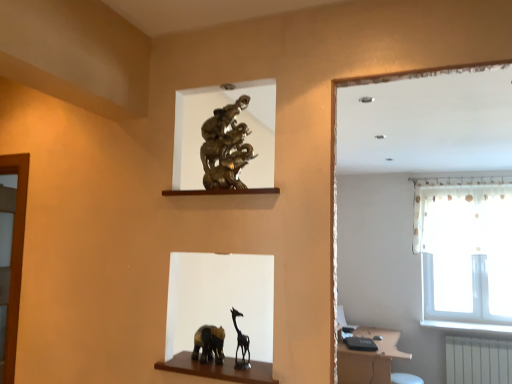
Question: Considering their positions, is matte brown vanity at lower right located in front of or behind white sheer curtain at upper right?

Choices:
 (A) front
 (B) behind

Answer: (A)

Question: Do you think matte brown vanity at lower right is within white sheer curtain at upper right, or outside of it?

Choices:
 (A) inside
 (B) outside

Answer: (B)

Question: Estimate the real-world distances between objects in this image. Which object is farther from the matte brown vanity at lower right?

Choices:
 (A) white sheer curtain at upper right
 (B) white plastic radiator at lower right

Answer: (A)

Question: Based on their relative distances, which object is nearer to the white sheer curtain at upper right?

Choices:
 (A) white plastic radiator at lower right
 (B) matte brown vanity at lower right

Answer: (A)